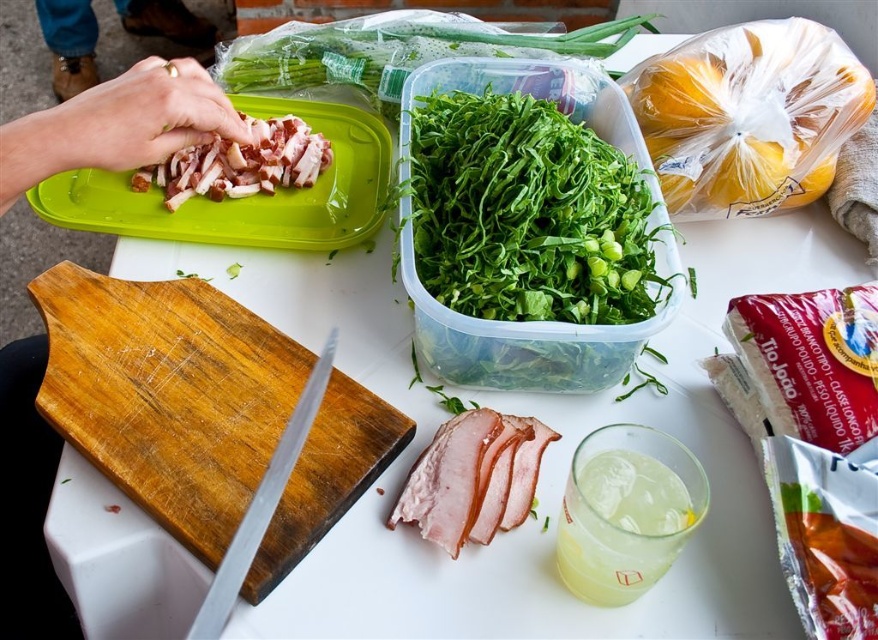
You are a chef standing at the white table in the foreground. You need to place a new ingredient on the wooden cutting board at lower left. Where should you place it relative to the table?

The wooden cutting board at lower left is located at point [167,394] on the table, so you should place the new ingredient at that specific coordinate relative to the table.

You are a chef preparing ingredients and need to place the silver metallic knife at lower left near the wooden cutting board at lower left. Based on the scene, where should you position the knife relative to the cutting board?

The wooden cutting board at lower left is to the left of the silver metallic knife at lower left, so you should position the knife to the right of the wooden cutting board at lower left.